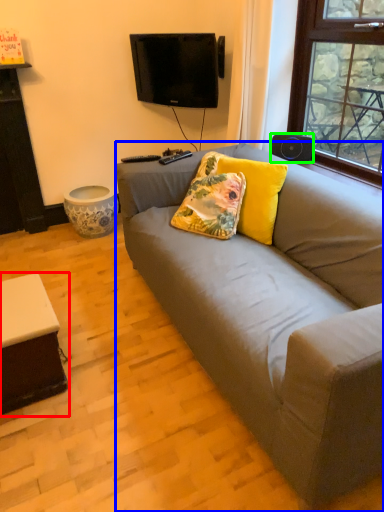
Question: Based on their relative distances, which object is farther from table (highlighted by a red box)? Choose from studio couch (highlighted by a blue box) and loudspeaker (highlighted by a green box).

Choices:
 (A) studio couch
 (B) loudspeaker

Answer: (B)